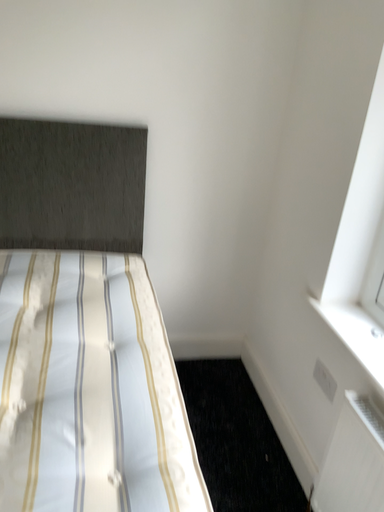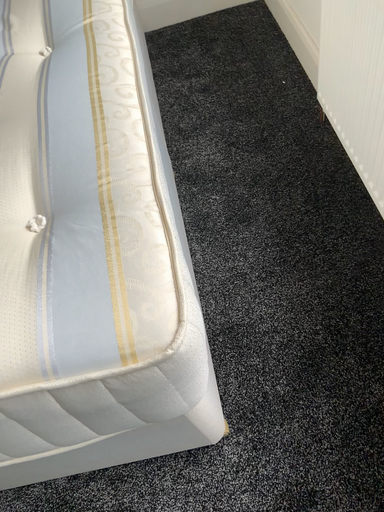
Question: Which way did the camera rotate in the video?

Choices:
 (A) rotated left
 (B) rotated right

Answer: (A)